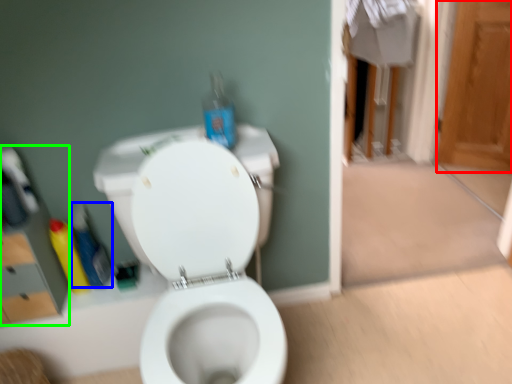
Question: Which is farther away from screen door (highlighted by a red box)? cleaning product (highlighted by a blue box) or medicine cabinet (highlighted by a green box)?

Choices:
 (A) cleaning product
 (B) medicine cabinet

Answer: (B)